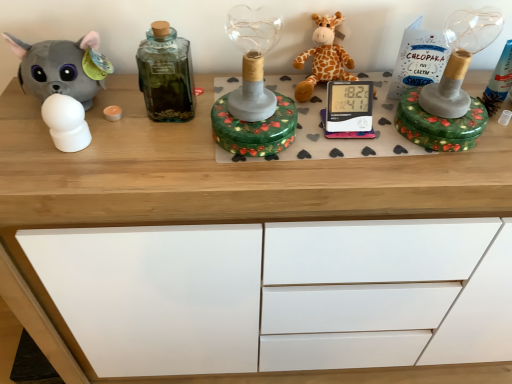
Question: From the image's perspective, is orange plush giraffe at center, acting as the second toy starting from the left, over matte gray plush toy at left, the 1th toy when ordered from left to right?

Choices:
 (A) no
 (B) yes

Answer: (B)

Question: Could you tell me if orange plush giraffe at center, acting as the second toy starting from the left, is facing matte gray plush toy at left, the 1th toy when ordered from left to right?

Choices:
 (A) no
 (B) yes

Answer: (A)

Question: Can you confirm if orange plush giraffe at center, the first toy in the right-to-left sequence, is shorter than matte gray plush toy at left, the 2th toy when ordered from right to left?

Choices:
 (A) yes
 (B) no

Answer: (A)

Question: Does orange plush giraffe at center, acting as the second toy starting from the left, come behind matte gray plush toy at left, the 1th toy when ordered from left to right?

Choices:
 (A) yes
 (B) no

Answer: (A)

Question: Is orange plush giraffe at center, the first toy in the right-to-left sequence, taller than matte gray plush toy at left, the 2th toy when ordered from right to left?

Choices:
 (A) no
 (B) yes

Answer: (A)

Question: Can we say orange plush giraffe at center, acting as the second toy starting from the left, lies outside matte gray plush toy at left, the 1th toy when ordered from left to right?

Choices:
 (A) no
 (B) yes

Answer: (B)

Question: Is orange plush giraffe at center, acting as the second toy starting from the left, positioned before green glass bottle at center?

Choices:
 (A) no
 (B) yes

Answer: (A)

Question: Is orange plush giraffe at center, the first toy in the right-to-left sequence, at the right side of green glass bottle at center?

Choices:
 (A) yes
 (B) no

Answer: (A)

Question: Is orange plush giraffe at center, the first toy in the right-to-left sequence, located outside green glass bottle at center?

Choices:
 (A) yes
 (B) no

Answer: (A)

Question: From the image's perspective, is orange plush giraffe at center, acting as the second toy starting from the left, located above green glass bottle at center?

Choices:
 (A) yes
 (B) no

Answer: (A)

Question: From a real-world perspective, is orange plush giraffe at center, acting as the second toy starting from the left, positioned under green glass bottle at center based on gravity?

Choices:
 (A) yes
 (B) no

Answer: (A)

Question: Considering the relative sizes of orange plush giraffe at center, acting as the second toy starting from the left, and green glass bottle at center in the image provided, is orange plush giraffe at center, acting as the second toy starting from the left, wider than green glass bottle at center?

Choices:
 (A) no
 (B) yes

Answer: (B)

Question: From a real-world perspective, is matte gray plush toy at left, the 1th toy when ordered from left to right, located beneath green glass bottle at center?

Choices:
 (A) yes
 (B) no

Answer: (A)